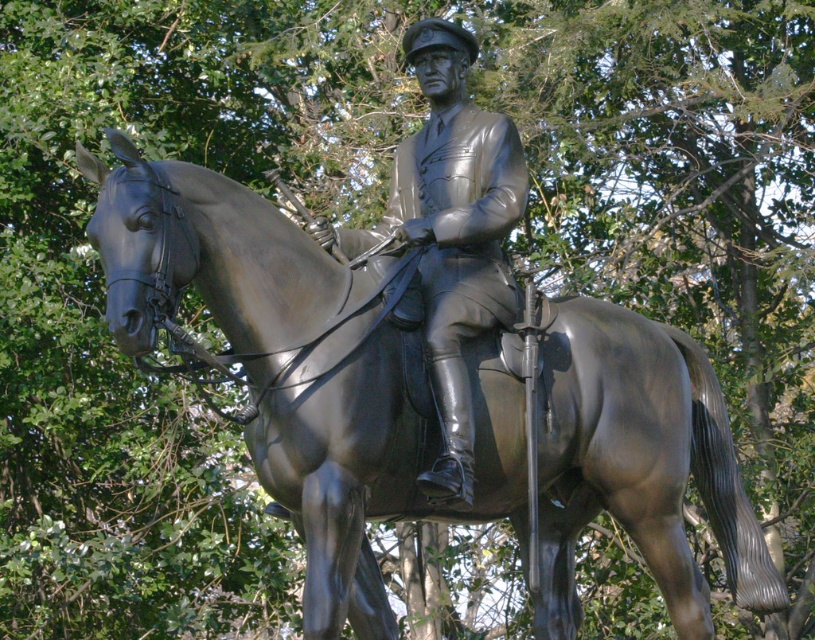
You are an art student analyzing the statue in the park. You notice the shiny bronze horse at center and the polished bronze statue at center. Which object is closer to the viewer?

The shiny bronze horse at center is closer to the viewer than the polished bronze statue at center.

You are a park visitor standing at the entrance of the park. You want to locate the shiny bronze horse at center. Based on its coordinates, in which general direction should you walk from the entrance to find it?

The shiny bronze horse at center is located at coordinates point (302, 369). Since the entrance is typically at the edge, moving towards the center would mean walking towards the middle of the park. Therefore, you should walk towards the central area of the park to find the shiny bronze horse at center.

You are an art conservator assessing the spacing between two bronze elements in a park statue. The statue includes a shiny bronze horse at center and a polished bronze statue at center. Based on standard conservation guidelines, which require at least 36 inches between separate bronze components to prevent corrosion from humidity, is the current spacing sufficient?

The shiny bronze horse at center and polished bronze statue at center are 34.01 inches apart, which is less than the required 36 inches. Therefore, the spacing is insufficient to meet conservation guidelines.